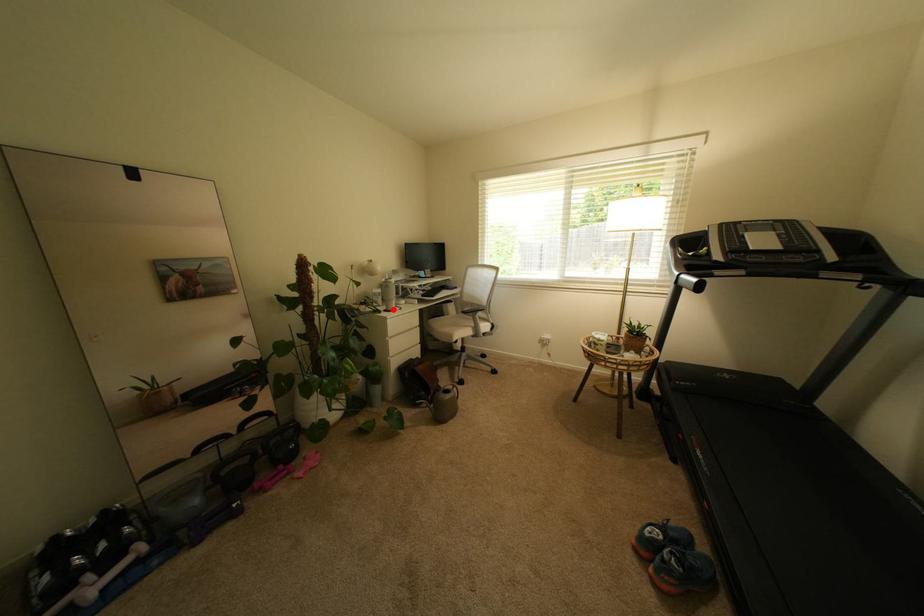
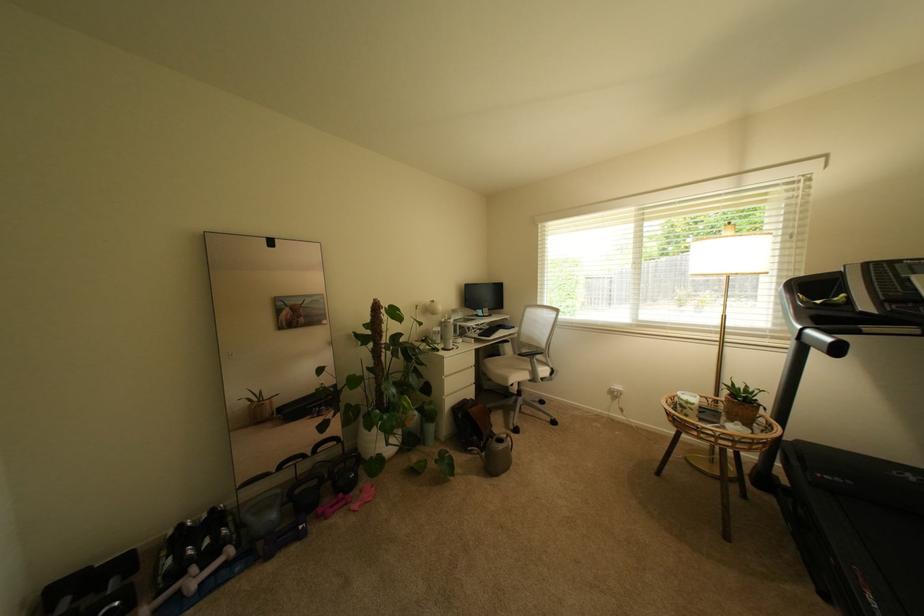
Where in the second image is the point corresponding to the highlighted location from the first image?

(451, 347)